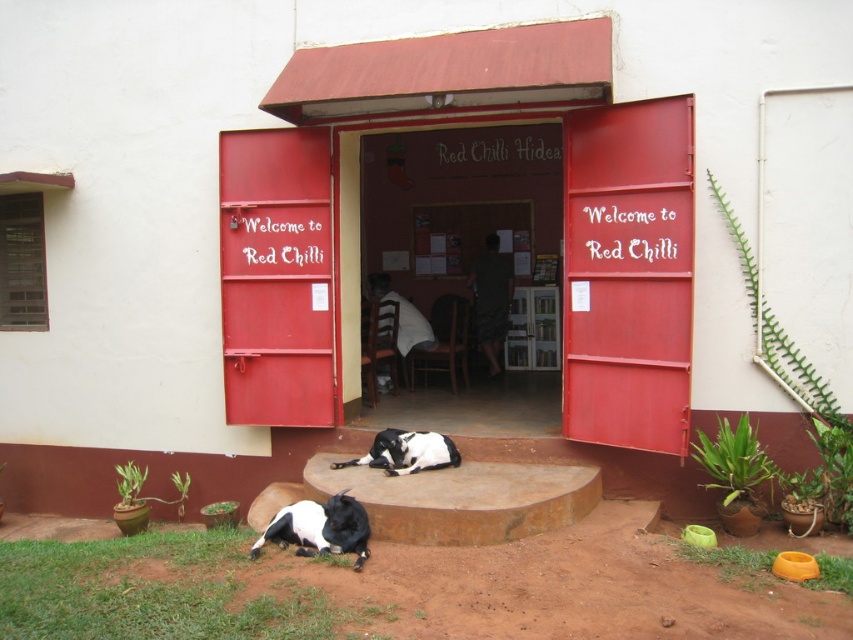
Consider the image. Can you confirm if brown wooden door at center is positioned to the right of black and white fur dog at lower center?

Yes, brown wooden door at center is to the right of black and white fur dog at lower center.

From the picture: Can you confirm if brown wooden door at center is smaller than black and white fur dog at lower center?

No.

This screenshot has width=853, height=640. Describe the element at coordinates (463, 227) in the screenshot. I see `brown wooden door at center` at that location.

The height and width of the screenshot is (640, 853). I want to click on brown wooden door at center, so click(x=463, y=227).

Who is positioned more to the left, black and white fur at lower left or black and white fur dog at lower center?

From the viewer's perspective, black and white fur at lower left appears more on the left side.

Which of these two, black and white fur at lower left or black and white fur dog at lower center, stands taller?

black and white fur at lower left

From the picture: Who is more forward, (289, 536) or (418, 470)?

Positioned in front is point (289, 536).

At what (x,y) coordinates should I click in order to perform the action: click on black and white fur at lower left. Please return your answer as a coordinate pair (x, y). Looking at the image, I should click on point(318,529).

Which is behind, point (436, 266) or point (364, 547)?

Point (436, 266)

Is point (436, 147) positioned in front of point (350, 513)?

No, it is behind (350, 513).

Is point (479, 163) closer to viewer compared to point (329, 499)?

No.

What are the coordinates of `brown wooden door at center` in the screenshot? It's located at (463, 227).